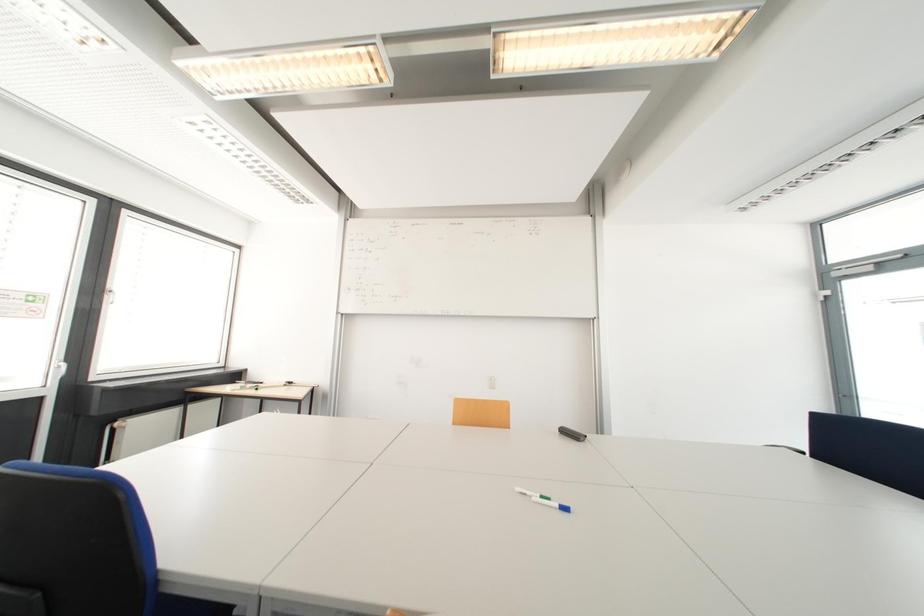
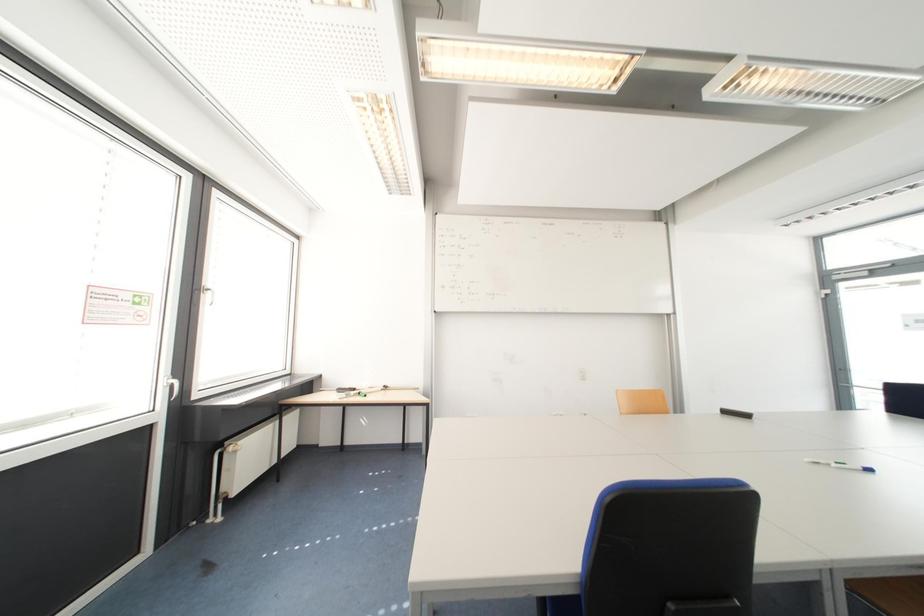
Question: In a continuous first-person perspective shot, in which direction is the camera moving?

Choices:
 (A) Left
 (B) Right
 (C) Forward
 (D) Backward

Answer: (A)